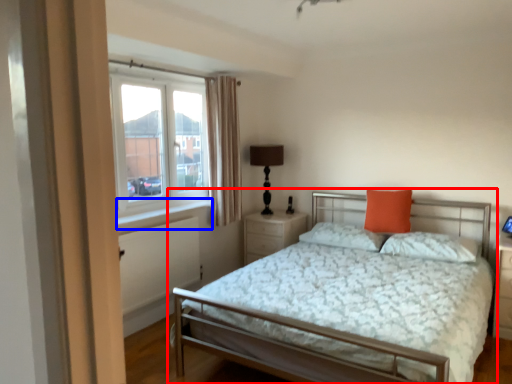
Question: Which of the following is the closest to the observer, bed (highlighted by a red box) or window sill (highlighted by a blue box)?

Choices:
 (A) bed
 (B) window sill

Answer: (A)